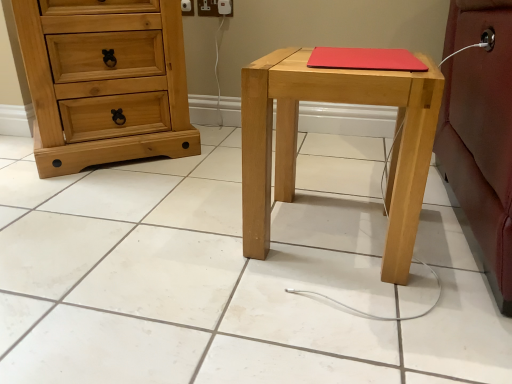
What do you see at coordinates (296, 141) in the screenshot? I see `natural wood stool at center` at bounding box center [296, 141].

What are the coordinates of `natural wood stool at center` in the screenshot? It's located at point(296,141).

What do you see at coordinates (105, 85) in the screenshot?
I see `natural wood chest of drawers at left` at bounding box center [105, 85].

Identify the location of natural wood chest of drawers at left. (105, 85).

This screenshot has width=512, height=384. Find the location of `natural wood stool at center`. natural wood stool at center is located at coordinates (296, 141).

Is natural wood stool at center to the right of natural wood chest of drawers at left from the viewer's perspective?

Yes.

Which is in front, natural wood stool at center or natural wood chest of drawers at left?

natural wood stool at center.

Does point (358, 71) appear closer or farther from the camera than point (95, 131)?

Point (358, 71) is positioned closer to the camera compared to point (95, 131).

From the image's perspective, which one is positioned lower, natural wood stool at center or natural wood chest of drawers at left?

natural wood stool at center, from the image's perspective.

From a real-world perspective, is natural wood stool at center positioned under natural wood chest of drawers at left based on gravity?

Indeed, from a real-world perspective, natural wood stool at center is positioned beneath natural wood chest of drawers at left.

In the scene shown: Considering the relative sizes of natural wood stool at center and natural wood chest of drawers at left in the image provided, is natural wood stool at center thinner than natural wood chest of drawers at left?

Correct, the width of natural wood stool at center is less than that of natural wood chest of drawers at left.

Does natural wood stool at center have a lesser height compared to natural wood chest of drawers at left?

Indeed, natural wood stool at center has a lesser height compared to natural wood chest of drawers at left.

Looking at this image, does natural wood stool at center have a larger size compared to natural wood chest of drawers at left?

No, natural wood stool at center is not bigger than natural wood chest of drawers at left.

Is natural wood stool at center located outside natural wood chest of drawers at left?

natural wood stool at center lies outside natural wood chest of drawers at left's area.

Consider the image. Is the surface of natural wood stool at center in direct contact with natural wood chest of drawers at left?

No, natural wood stool at center is not in contact with natural wood chest of drawers at left.

Could you tell me if natural wood stool at center is turned towards natural wood chest of drawers at left?

No.

In order to click on chest of drawers above the natural wood stool at center (from a real-world perspective) in this screenshot , I will do `click(105, 85)`.

Is natural wood chest of drawers at left to the left of natural wood stool at center from the viewer's perspective?

Correct, you'll find natural wood chest of drawers at left to the left of natural wood stool at center.

Is the depth of natural wood chest of drawers at left greater than that of natural wood stool at center?

Yes, natural wood chest of drawers at left is further from the viewer.

Is point (167, 155) farther from camera compared to point (345, 80)?

Yes, point (167, 155) is behind point (345, 80).

From the image's perspective, is natural wood chest of drawers at left on top of natural wood stool at center?

Yes.

From a real-world perspective, is natural wood chest of drawers at left under natural wood stool at center?

No, from a real-world perspective, natural wood chest of drawers at left is not below natural wood stool at center.

Looking at their sizes, would you say natural wood chest of drawers at left is wider or thinner than natural wood stool at center?

In the image, natural wood chest of drawers at left appears to be wider than natural wood stool at center.

Can you confirm if natural wood chest of drawers at left is taller than natural wood stool at center?

Yes, natural wood chest of drawers at left is taller than natural wood stool at center.

Between natural wood chest of drawers at left and natural wood stool at center, which one has smaller size?

natural wood stool at center is smaller.

Is natural wood chest of drawers at left not within natural wood stool at center?

Indeed, natural wood chest of drawers at left is completely outside natural wood stool at center.

Is natural wood chest of drawers at left directly adjacent to natural wood stool at center?

No, natural wood chest of drawers at left is not beside natural wood stool at center.

Is natural wood chest of drawers at left turned away from natural wood stool at center?

No, natural wood stool at center is not at the back of natural wood chest of drawers at left.

What's the angular difference between natural wood chest of drawers at left and natural wood stool at center's facing directions?

40.9 degrees separate the facing orientations of natural wood chest of drawers at left and natural wood stool at center.

Image resolution: width=512 pixels, height=384 pixels. Identify the location of stool below the natural wood chest of drawers at left (from the image's perspective). (296, 141).

Where is `chest of drawers on the left side of natural wood stool at center`? chest of drawers on the left side of natural wood stool at center is located at coordinates (105, 85).

This screenshot has width=512, height=384. In the image, there is a natural wood stool at center. In order to click on the chest of drawers above it (from the image's perspective) in this screenshot , I will do (x=105, y=85).